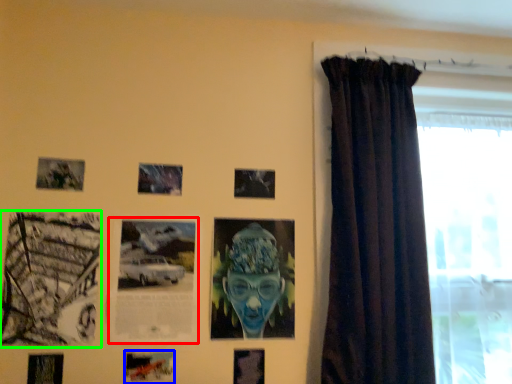
Question: Which is nearer to the picture frame (highlighted by a red box)? picture frame (highlighted by a blue box) or picture frame (highlighted by a green box).

Choices:
 (A) picture frame
 (B) picture frame

Answer: (B)